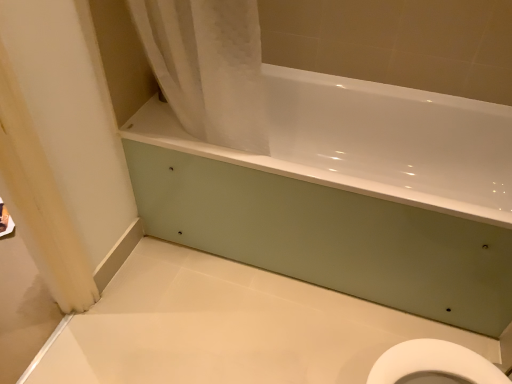
Question: Would you say white fabric shower curtain at upper left is outside white glossy bathtub at center?

Choices:
 (A) yes
 (B) no

Answer: (A)

Question: Does white fabric shower curtain at upper left have a lesser width compared to white glossy bathtub at center?

Choices:
 (A) yes
 (B) no

Answer: (A)

Question: From a real-world perspective, is white fabric shower curtain at upper left on top of white glossy bathtub at center?

Choices:
 (A) no
 (B) yes

Answer: (B)

Question: Can you confirm if white fabric shower curtain at upper left is shorter than white glossy bathtub at center?

Choices:
 (A) no
 (B) yes

Answer: (A)

Question: Would you say white fabric shower curtain at upper left is a long distance from white glossy bathtub at center?

Choices:
 (A) no
 (B) yes

Answer: (A)

Question: Does white fabric shower curtain at upper left have a larger size compared to white glossy bathtub at center?

Choices:
 (A) no
 (B) yes

Answer: (A)

Question: Is white glossy bathtub at center further to the viewer compared to white fabric shower curtain at upper left?

Choices:
 (A) no
 (B) yes

Answer: (B)

Question: From a real-world perspective, is white glossy bathtub at center over white fabric shower curtain at upper left?

Choices:
 (A) yes
 (B) no

Answer: (B)

Question: Is white glossy bathtub at center oriented away from white fabric shower curtain at upper left?

Choices:
 (A) no
 (B) yes

Answer: (A)

Question: Is white glossy bathtub at center located outside white fabric shower curtain at upper left?

Choices:
 (A) no
 (B) yes

Answer: (B)

Question: Can you confirm if white glossy bathtub at center is thinner than white fabric shower curtain at upper left?

Choices:
 (A) no
 (B) yes

Answer: (A)

Question: Is white glossy bathtub at center to the right of white fabric shower curtain at upper left from the viewer's perspective?

Choices:
 (A) yes
 (B) no

Answer: (A)

Question: Considering their positions, is white fabric shower curtain at upper left located in front of or behind white glossy bathtub at center?

Choices:
 (A) front
 (B) behind

Answer: (A)